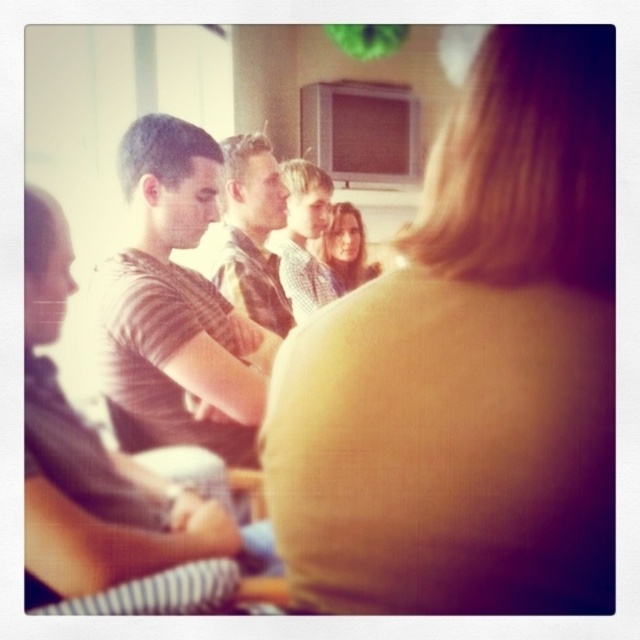
Which is more to the right, striped cotton shirt at center or smooth skin face at center?

Positioned to the right is smooth skin face at center.

Is striped cotton shirt at center smaller than smooth skin face at center?

Yes, striped cotton shirt at center is smaller than smooth skin face at center.

Is point (116, 170) behind point (337, 262)?

No, (116, 170) is in front of (337, 262).

At what (x,y) coordinates should I click in order to perform the action: click on striped cotton shirt at center. Please return your answer as a coordinate pair (x, y). The image size is (640, 640). Looking at the image, I should click on pos(176,307).

Does point (314, 224) come in front of point (339, 292)?

That is True.

You are a GUI agent. You are given a task and a screenshot of the screen. Output one action in this format:
    pyautogui.click(x=<x>, y=<y>)
    Task: Click on the light brown shirt at center
    This screenshot has height=640, width=640.
    Given the screenshot: What is the action you would take?
    pyautogui.click(x=304, y=237)

Between striped cotton shirt at center and light brown shirt at center, which one appears on the left side from the viewer's perspective?

striped cotton shirt at center

Where is `striped cotton shirt at center`? The width and height of the screenshot is (640, 640). striped cotton shirt at center is located at coordinates (176, 307).

The image size is (640, 640). Identify the location of striped cotton shirt at center. (176, 307).